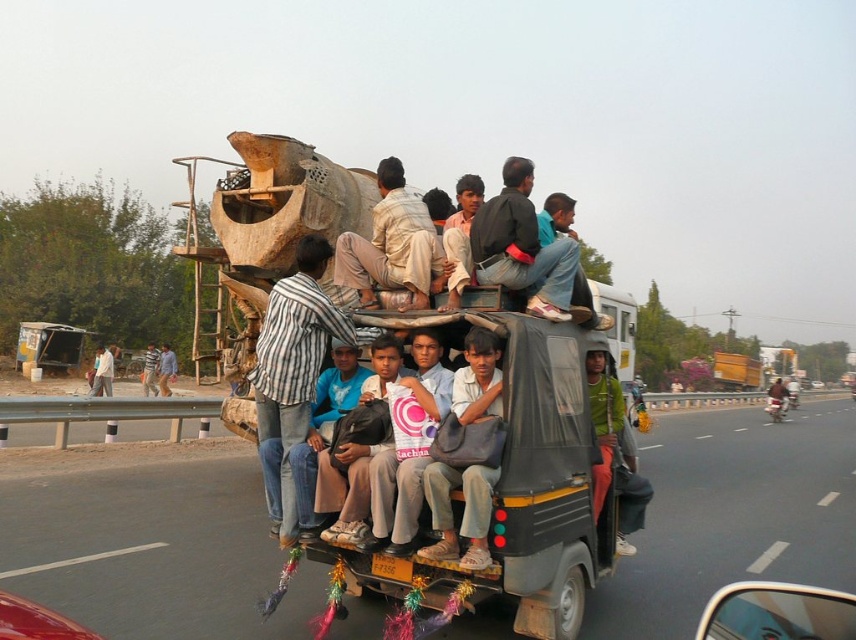
Who is taller, black rubber road at center or light brown fabric pants at center?

With more height is black rubber road at center.

Which is behind, point (92, 516) or point (387, 280)?

The point (92, 516) is more distant.

Locate an element on the screen. black rubber road at center is located at coordinates [x=152, y=547].

How distant is striped fabric shirt at center from dark blue jeans at center?

A distance of 5.36 feet exists between striped fabric shirt at center and dark blue jeans at center.

Which is above, striped fabric shirt at center or dark blue jeans at center?

Positioned higher is dark blue jeans at center.

Which is in front, point (302, 365) or point (533, 246)?

Point (302, 365) is in front.

Find the location of a particular element. striped fabric shirt at center is located at coordinates (293, 368).

Does dark blue jeans at center have a larger size compared to shiny red car at lower left?

No, dark blue jeans at center is not bigger than shiny red car at lower left.

This screenshot has width=856, height=640. I want to click on dark blue jeans at center, so click(522, 246).